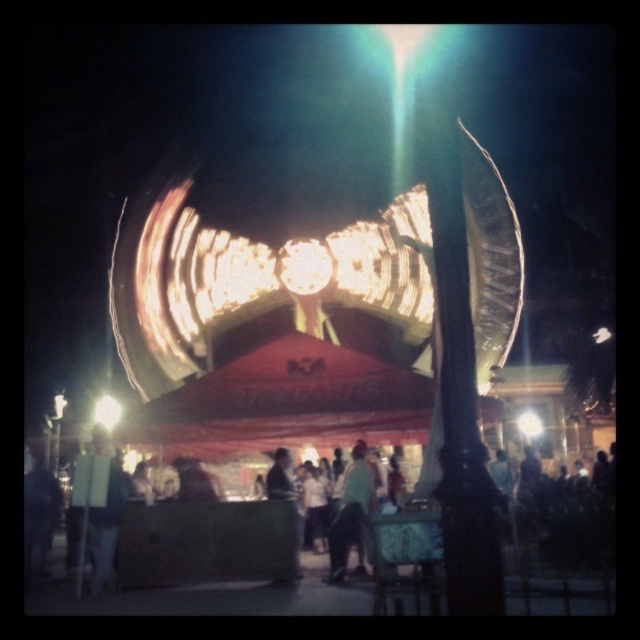
Question: Does light blue jeans at center have a lesser width compared to bright yellow light at center?

Choices:
 (A) yes
 (B) no

Answer: (B)

Question: Can you confirm if light blue jeans at center is smaller than bright yellow light at center?

Choices:
 (A) no
 (B) yes

Answer: (A)

Question: Which of the following is the farthest from the observer?

Choices:
 (A) (355, 445)
 (B) (97, 404)

Answer: (B)

Question: Which point is farther to the camera?

Choices:
 (A) (362, 552)
 (B) (104, 408)

Answer: (B)

Question: Does light blue jeans at center have a greater width compared to bright yellow light at center?

Choices:
 (A) no
 (B) yes

Answer: (B)